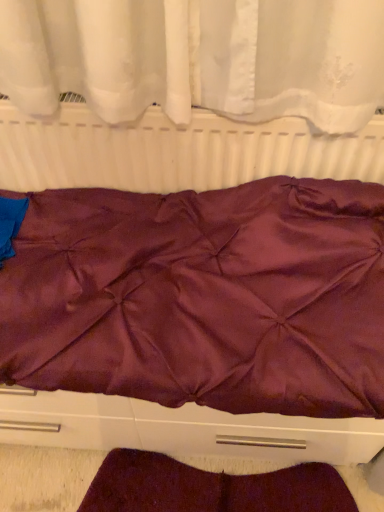
Question: Does satin purple bedspread at center appear on the right side of burgundy satin blanket at lower center?

Choices:
 (A) no
 (B) yes

Answer: (A)

Question: Is satin purple bedspread at center not inside burgundy satin blanket at lower center?

Choices:
 (A) yes
 (B) no

Answer: (A)

Question: Considering the relative positions of satin purple bedspread at center and burgundy satin blanket at lower center in the image provided, is satin purple bedspread at center to the left of burgundy satin blanket at lower center from the viewer's perspective?

Choices:
 (A) yes
 (B) no

Answer: (A)

Question: Does satin purple bedspread at center have a larger size compared to burgundy satin blanket at lower center?

Choices:
 (A) yes
 (B) no

Answer: (A)

Question: From the image's perspective, does satin purple bedspread at center appear lower than burgundy satin blanket at lower center?

Choices:
 (A) yes
 (B) no

Answer: (B)

Question: Considering the relative positions of satin purple bedspread at center and burgundy satin blanket at lower center in the image provided, is satin purple bedspread at center behind burgundy satin blanket at lower center?

Choices:
 (A) yes
 (B) no

Answer: (B)

Question: Are satin purple bedspread at center and matte white radiator at center far apart?

Choices:
 (A) no
 (B) yes

Answer: (A)

Question: From a real-world perspective, is satin purple bedspread at center beneath matte white radiator at center?

Choices:
 (A) no
 (B) yes

Answer: (B)

Question: Does satin purple bedspread at center have a greater width compared to matte white radiator at center?

Choices:
 (A) yes
 (B) no

Answer: (A)

Question: Is satin purple bedspread at center positioned behind matte white radiator at center?

Choices:
 (A) yes
 (B) no

Answer: (B)

Question: Is matte white radiator at center inside satin purple bedspread at center?

Choices:
 (A) no
 (B) yes

Answer: (A)

Question: Could you tell me if satin purple bedspread at center is facing matte white radiator at center?

Choices:
 (A) no
 (B) yes

Answer: (A)

Question: Is matte white radiator at center not close to satin purple bedspread at center?

Choices:
 (A) no
 (B) yes

Answer: (A)